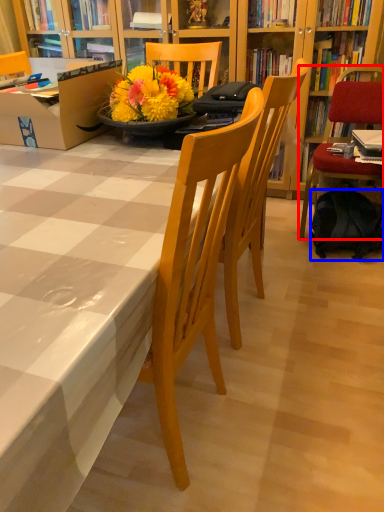
Question: Which object is further to the camera taking this photo, chair (highlighted by a red box) or backpack (highlighted by a blue box)?

Choices:
 (A) chair
 (B) backpack

Answer: (B)